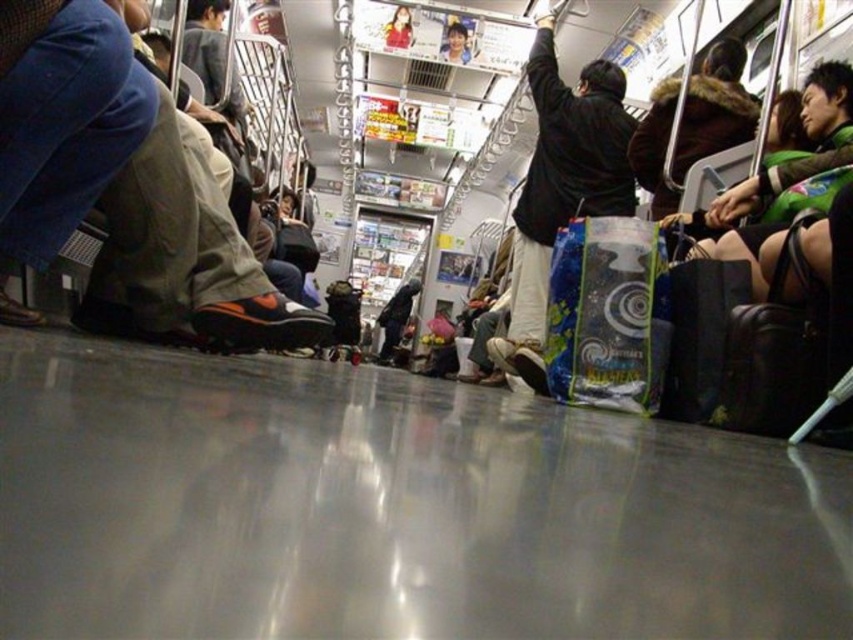
The height and width of the screenshot is (640, 853). What do you see at coordinates (125, 188) in the screenshot? I see `orange suede shoe at lower left` at bounding box center [125, 188].

Does point (213, 186) come farther from viewer compared to point (537, 237)?

No, it is in front of (537, 237).

Is point (77, 122) closer to camera compared to point (521, 205)?

Yes, it is.

Locate an element on the screen. orange suede shoe at lower left is located at coordinates (125, 188).